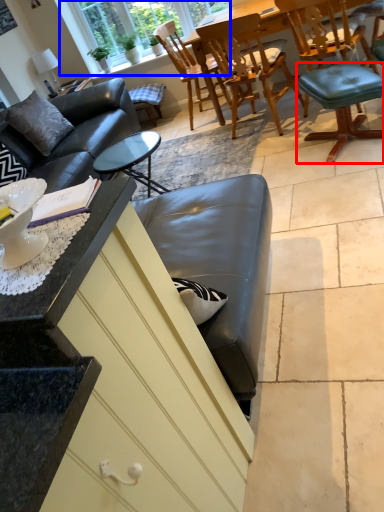
Question: Among these objects, which one is nearest to the camera, bar stool (highlighted by a red box) or window (highlighted by a blue box)?

Choices:
 (A) bar stool
 (B) window

Answer: (A)